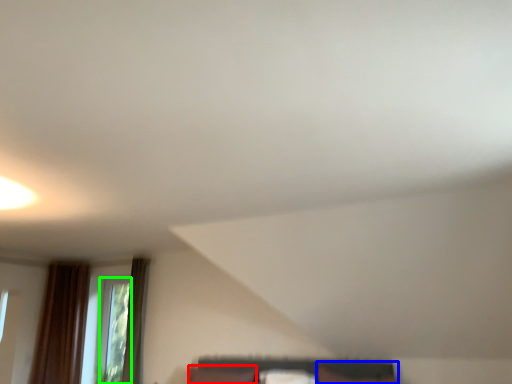
Question: Which is farther away from pillow (highlighted by a red box)? furniture (highlighted by a blue box) or window (highlighted by a green box)?

Choices:
 (A) furniture
 (B) window

Answer: (B)